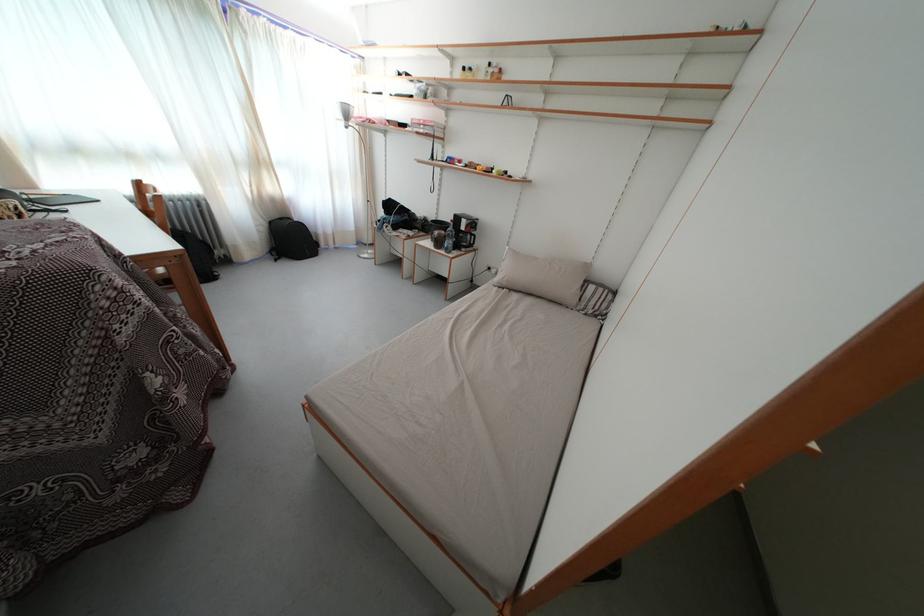
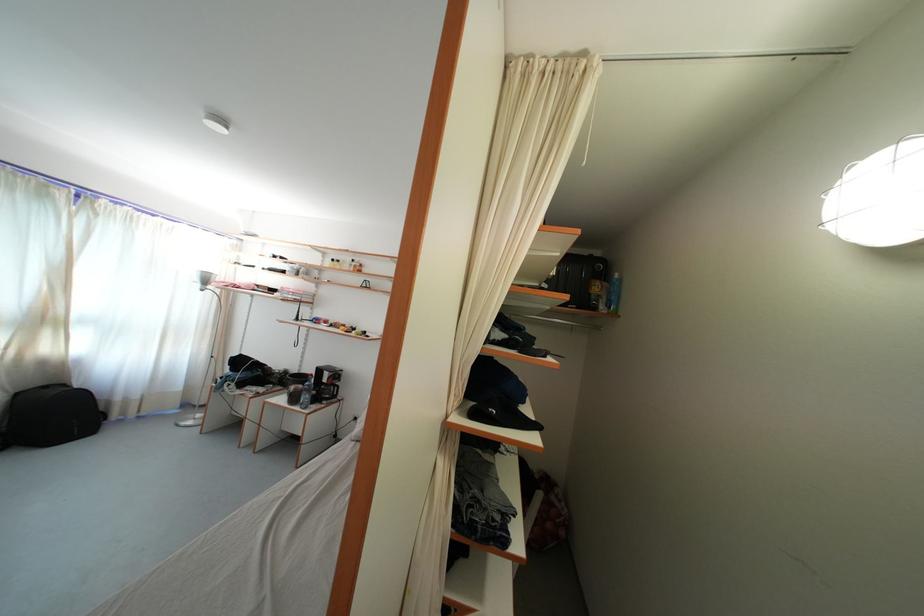
Locate, in the second image, the point that corresponds to (266,168) in the first image.

(52, 326)